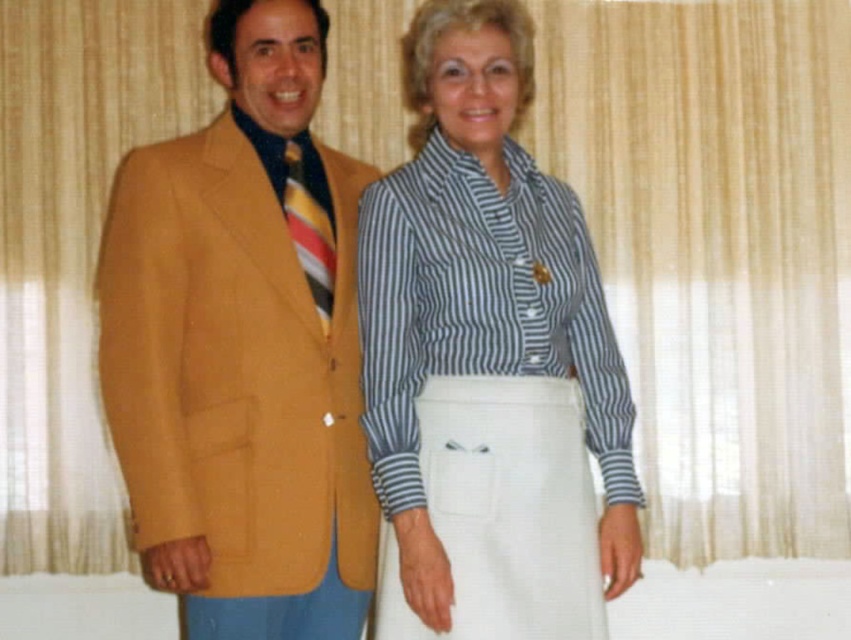
You are an interior designer planning to place a new sofa in a living room. The sofa will be positioned at point 0.544, 0.286. You have a matte gold blazer at left that you want to place near the sofa. Is the sofa location suitable for placing the blazer?

The matte gold blazer at left is already located at point (243, 348), so placing the sofa at that exact location would not leave space for the blazer nearby.

You are a photographer setting up for a group photo. You need to ensure that the matte gold blazer at left and the striped cotton shirt at center are both visible in the frame. Based on their heights, which object should you adjust your camera angle to focus on first to capture both properly?

The matte gold blazer at left is much taller than the striped cotton shirt at center, so you should focus on the matte gold blazer at left first to ensure it fits within the frame, then adjust for the shorter striped cotton shirt at center.

You are a photographer setting up for a group photo. You notice the matte gold blazer at left and the striped cotton shirt at center in your frame. Which object is closer to the camera?

The striped cotton shirt at center is closer to the camera because the matte gold blazer at left is positioned under it, indicating it is behind.